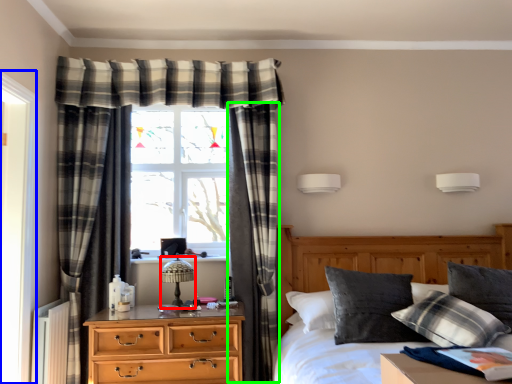
Question: Which object is positioned farthest from table lamp (highlighted by a red box)? Select from screen door (highlighted by a blue box) and curtain (highlighted by a green box).

Choices:
 (A) screen door
 (B) curtain

Answer: (A)